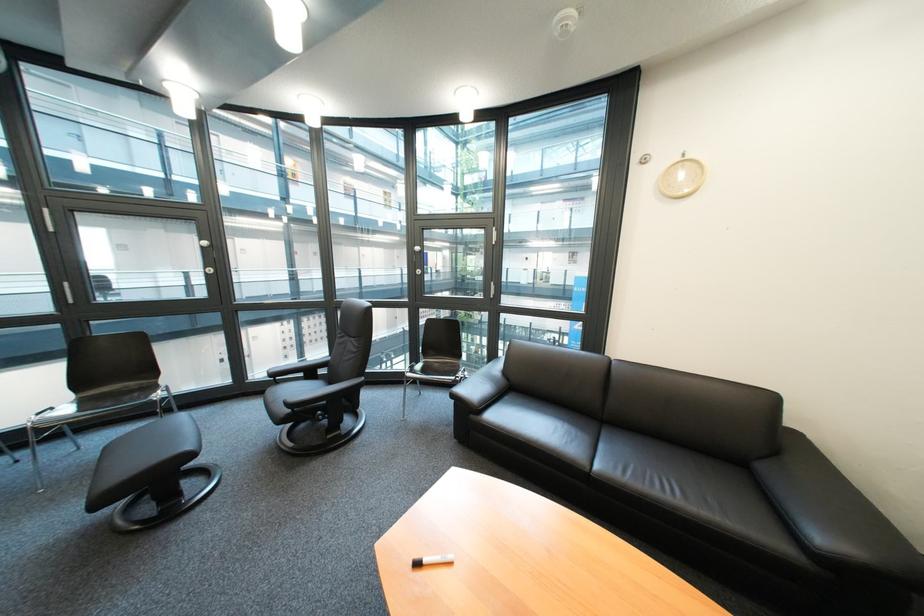
Find the location of `chair armrest`. chair armrest is located at coordinates (322, 394).